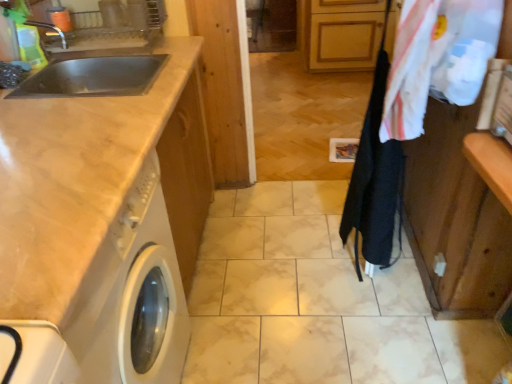
Find the location of `white glossy washing machine at left`. white glossy washing machine at left is located at coordinates (132, 296).

This screenshot has height=384, width=512. Identify the location of white cotton laundry at upper right. (437, 59).

What do you see at coordinates (72, 181) in the screenshot? I see `matte beige countertop at left` at bounding box center [72, 181].

This screenshot has width=512, height=384. In order to click on white glossy washing machine at left in this screenshot , I will do `click(132, 296)`.

Considering the sizes of objects black fabric clothesline at center-right and matte beige countertop at left in the image provided, who is shorter, black fabric clothesline at center-right or matte beige countertop at left?

With less height is matte beige countertop at left.

Do you think black fabric clothesline at center-right is within matte beige countertop at left, or outside of it?

black fabric clothesline at center-right lies outside matte beige countertop at left.

Measure the distance from black fabric clothesline at center-right to matte beige countertop at left.

A distance of 87.51 centimeters exists between black fabric clothesline at center-right and matte beige countertop at left.

From a real-world perspective, is black fabric clothesline at center-right on top of matte beige countertop at left?

Yes, from a real-world perspective, black fabric clothesline at center-right is over matte beige countertop at left

From the image's perspective, is black fabric clothesline at center-right on white cotton laundry at upper right?

Incorrect, from the image's perspective, black fabric clothesline at center-right is lower than white cotton laundry at upper right.

In the scene shown: Can you confirm if black fabric clothesline at center-right is bigger than white cotton laundry at upper right?

Indeed, black fabric clothesline at center-right has a larger size compared to white cotton laundry at upper right.

Is white glossy washing machine at left wider than matte beige countertop at left?

Indeed, white glossy washing machine at left has a greater width compared to matte beige countertop at left.

From their relative heights in the image, would you say white glossy washing machine at left is taller or shorter than matte beige countertop at left?

Clearly, white glossy washing machine at left is shorter compared to matte beige countertop at left.

Are white glossy washing machine at left and matte beige countertop at left located far from each other?

white glossy washing machine at left is near matte beige countertop at left, not far away.

The image size is (512, 384). I want to click on countertop below the white cotton laundry at upper right (from the image's perspective), so click(72, 181).

Does point (408, 44) come closer to viewer compared to point (29, 242)?

No, (408, 44) is behind (29, 242).

From a real-world perspective, between white cotton laundry at upper right and matte beige countertop at left, who is vertically lower?

In real-world perspective, matte beige countertop at left is lower.

Measure the distance from white cotton laundry at upper right to matte beige countertop at left.

white cotton laundry at upper right and matte beige countertop at left are 30.94 inches apart from each other.

From the image's perspective, is matte beige countertop at left over white cotton laundry at upper right?

No, from the image's perspective, matte beige countertop at left is not above white cotton laundry at upper right.

Does matte beige countertop at left have a smaller size compared to white cotton laundry at upper right?

Actually, matte beige countertop at left might be larger than white cotton laundry at upper right.

Considering the relative sizes of matte beige countertop at left and white cotton laundry at upper right in the image provided, is matte beige countertop at left taller than white cotton laundry at upper right?

Yes, matte beige countertop at left is taller than white cotton laundry at upper right.

Is matte beige countertop at left positioned far away from white cotton laundry at upper right?

No.

Where is `clothesline behind the white glossy washing machine at left`? This screenshot has height=384, width=512. clothesline behind the white glossy washing machine at left is located at coordinates (375, 183).

From the image's perspective, which one is positioned lower, white glossy washing machine at left or black fabric clothesline at center-right?

white glossy washing machine at left.

Considering the relative sizes of white glossy washing machine at left and black fabric clothesline at center-right in the image provided, is white glossy washing machine at left shorter than black fabric clothesline at center-right?

Correct, white glossy washing machine at left is not as tall as black fabric clothesline at center-right.

From the picture: Does white glossy washing machine at left turn towards black fabric clothesline at center-right?

No.

You are a GUI agent. You are given a task and a screenshot of the screen. Output one action in this format:
    pyautogui.click(x=<x>, y=<y>)
    Task: Click on the laundry that is behind the white glossy washing machine at left
    Image resolution: width=512 pixels, height=384 pixels.
    Given the screenshot: What is the action you would take?
    pyautogui.click(x=437, y=59)

Which is in front, white cotton laundry at upper right or white glossy washing machine at left?

white glossy washing machine at left is in front.

How much distance is there between white cotton laundry at upper right and white glossy washing machine at left?

A distance of 32.47 inches exists between white cotton laundry at upper right and white glossy washing machine at left.

Find the location of `countertop in front of the black fabric clothesline at center-right`. countertop in front of the black fabric clothesline at center-right is located at coordinates (72, 181).

This screenshot has height=384, width=512. I want to click on clothesline below the white cotton laundry at upper right (from the image's perspective), so click(375, 183).

Estimate the real-world distances between objects in this image. Which object is closer to white cotton laundry at upper right, white glossy washing machine at left or black fabric clothesline at center-right?

black fabric clothesline at center-right is positioned closer to the anchor white cotton laundry at upper right.

Looking at the image, which one is located further to white cotton laundry at upper right, black fabric clothesline at center-right or matte beige countertop at left?

matte beige countertop at left.

Which object lies further to the anchor point matte beige countertop at left, black fabric clothesline at center-right or white cotton laundry at upper right?

black fabric clothesline at center-right.

Considering their positions, is black fabric clothesline at center-right positioned closer to matte beige countertop at left than white glossy washing machine at left?

The object closer to matte beige countertop at left is white glossy washing machine at left.

Which object lies further to the anchor point white cotton laundry at upper right, white glossy washing machine at left or matte beige countertop at left?

white glossy washing machine at left.

Estimate the real-world distances between objects in this image. Which object is closer to matte beige countertop at left, white cotton laundry at upper right or black fabric clothesline at center-right?

Among the two, white cotton laundry at upper right is located nearer to matte beige countertop at left.

From the image, which object appears to be nearer to white glossy washing machine at left, white cotton laundry at upper right or black fabric clothesline at center-right?

Based on the image, white cotton laundry at upper right appears to be nearer to white glossy washing machine at left.

Based on their spatial positions, is black fabric clothesline at center-right or matte beige countertop at left closer to white glossy washing machine at left?

matte beige countertop at left lies closer to white glossy washing machine at left than the other object.

Where is `countertop between white glossy washing machine at left and white cotton laundry at upper right in the horizontal direction`? Image resolution: width=512 pixels, height=384 pixels. countertop between white glossy washing machine at left and white cotton laundry at upper right in the horizontal direction is located at coordinates (72, 181).

Where is `clothesline between white glossy washing machine at left and white cotton laundry at upper right in the horizontal direction`? This screenshot has width=512, height=384. clothesline between white glossy washing machine at left and white cotton laundry at upper right in the horizontal direction is located at coordinates (375, 183).

In order to click on clothesline between matte beige countertop at left and white cotton laundry at upper right in the horizontal direction in this screenshot , I will do `click(375, 183)`.

The image size is (512, 384). I want to click on countertop between white glossy washing machine at left and black fabric clothesline at center-right, so click(72, 181).